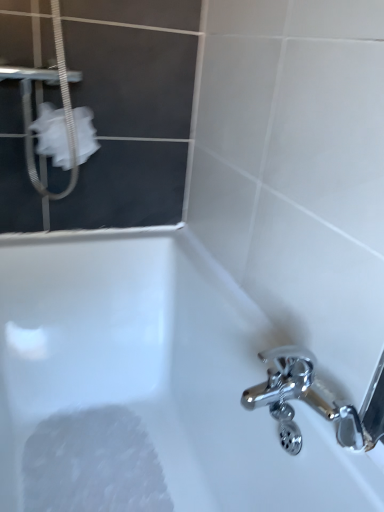
Question: Is white fabric at upper left at the left side of white glossy bathtub at lower left?

Choices:
 (A) yes
 (B) no

Answer: (A)

Question: From the image's perspective, is white fabric at upper left under white glossy bathtub at lower left?

Choices:
 (A) yes
 (B) no

Answer: (B)

Question: Can you confirm if white fabric at upper left is shorter than white glossy bathtub at lower left?

Choices:
 (A) yes
 (B) no

Answer: (A)

Question: Can you confirm if white fabric at upper left is smaller than white glossy bathtub at lower left?

Choices:
 (A) yes
 (B) no

Answer: (A)

Question: From the image's perspective, is white fabric at upper left over white glossy bathtub at lower left?

Choices:
 (A) yes
 (B) no

Answer: (A)

Question: Relative to white fabric screen door at upper left, is white fabric at upper left in front or behind?

Choices:
 (A) behind
 (B) front

Answer: (A)

Question: In the image, is white fabric at upper left on the left side or the right side of white fabric screen door at upper left?

Choices:
 (A) right
 (B) left

Answer: (B)

Question: From the image's perspective, is white fabric at upper left positioned above or below white fabric screen door at upper left?

Choices:
 (A) above
 (B) below

Answer: (B)

Question: From a real-world perspective, is white fabric at upper left physically located above or below white fabric screen door at upper left?

Choices:
 (A) below
 (B) above

Answer: (A)

Question: Is white fabric at upper left in front of or behind white foamy at bottom left in the image?

Choices:
 (A) front
 (B) behind

Answer: (B)

Question: In terms of width, does white fabric at upper left look wider or thinner when compared to white foamy at bottom left?

Choices:
 (A) wide
 (B) thin

Answer: (B)

Question: Does point (81, 135) appear closer or farther from the camera than point (79, 454)?

Choices:
 (A) farther
 (B) closer

Answer: (B)

Question: Do you think white fabric at upper left is within white foamy at bottom left, or outside of it?

Choices:
 (A) outside
 (B) inside

Answer: (A)

Question: From a real-world perspective, is white foamy at bottom left physically located above or below white fabric screen door at upper left?

Choices:
 (A) above
 (B) below

Answer: (B)

Question: Based on their sizes in the image, would you say white foamy at bottom left is bigger or smaller than white fabric screen door at upper left?

Choices:
 (A) big
 (B) small

Answer: (B)